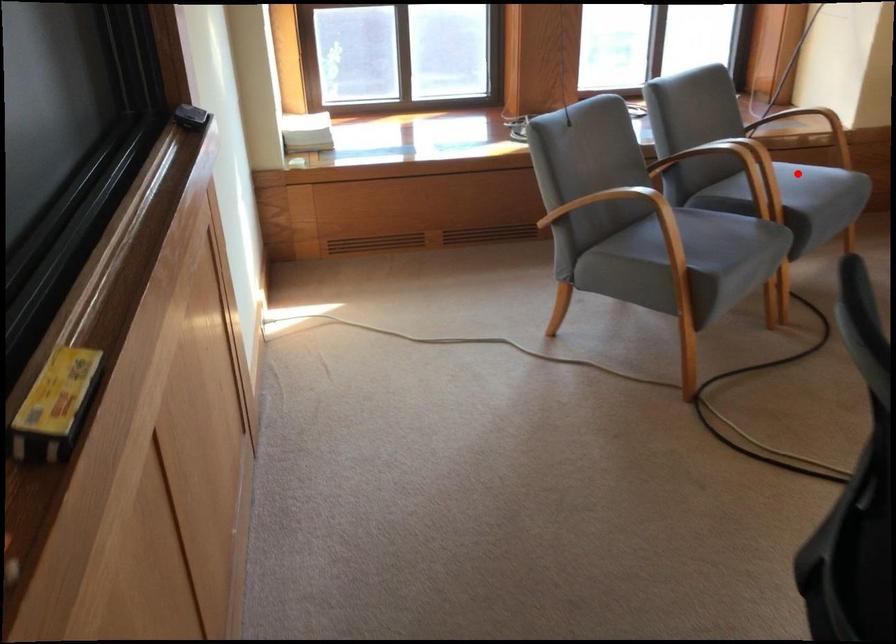
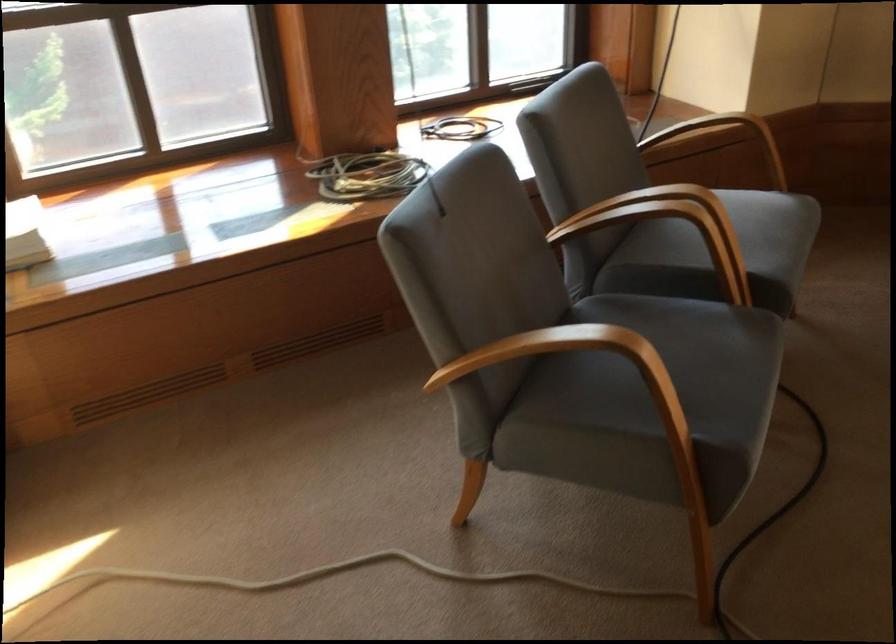
The point at the highlighted location is marked in the first image. Where is the corresponding point in the second image?

(752, 232)